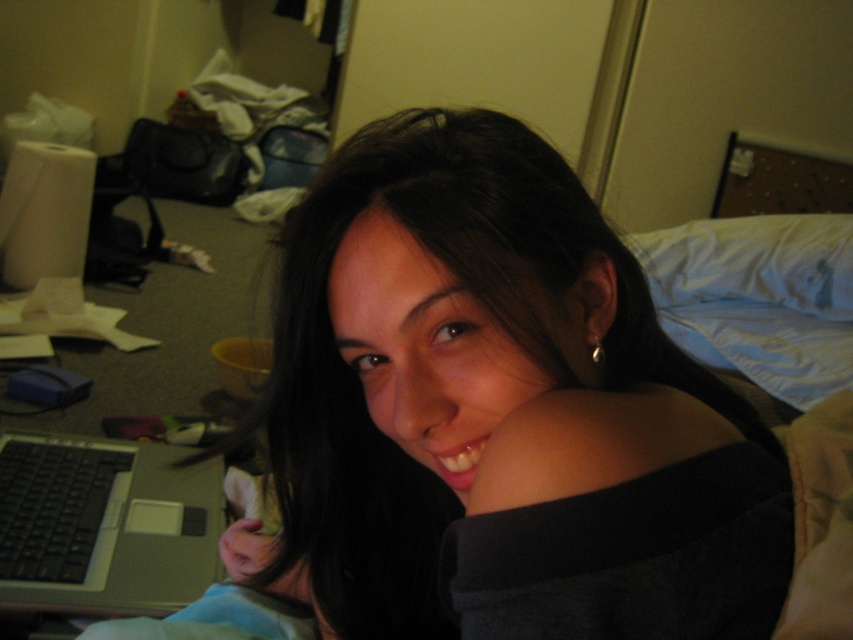
Question: Which of the following is the farthest from the observer?

Choices:
 (A) (119, 524)
 (B) (618, 330)

Answer: (A)

Question: Considering the real-world distances, which object is closest to the matte black hair at center?

Choices:
 (A) white soft pillow at upper right
 (B) silver metallic laptop at lower left

Answer: (B)

Question: Can you confirm if silver metallic laptop at lower left is smaller than white soft pillow at upper right?

Choices:
 (A) yes
 (B) no

Answer: (A)

Question: In this image, where is matte black hair at center located relative to silver metallic laptop at lower left?

Choices:
 (A) below
 (B) above

Answer: (B)

Question: Can you confirm if silver metallic laptop at lower left is smaller than white soft pillow at upper right?

Choices:
 (A) yes
 (B) no

Answer: (A)

Question: Which object appears closest to the camera in this image?

Choices:
 (A) silver metallic laptop at lower left
 (B) matte black hair at center
 (C) white soft pillow at upper right

Answer: (B)